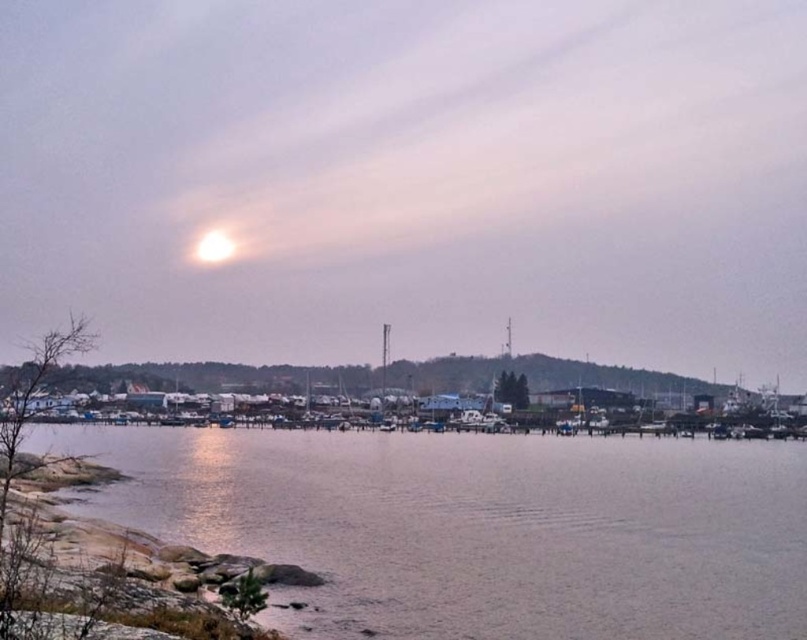
You are an astronomer observing the sky and the water surface in the coastal scene. You notice the smooth water at lower center and the bright white orb at upper center. Which object appears taller in the image?

The smooth water at lower center appears taller than the bright white orb at upper center in the image.

You are a photographer standing on the rocky shoreline and want to capture both the smooth water at lower center and the bright white orb at upper center in the same frame. Given that your camera has a maximum focal length that allows capturing objects up to 70 meters apart, will you be able to include both in a single shot?

The smooth water at lower center and bright white orb at upper center are 75.00 meters apart. Since your camera can only capture up to 70 meters, you won

You are an astronomer observing the coastal scene. You notice the smooth water at lower center and the bright white orb at upper center. Which object appears larger in the image?

The smooth water at lower center appears larger than the bright white orb at upper center according to the description.